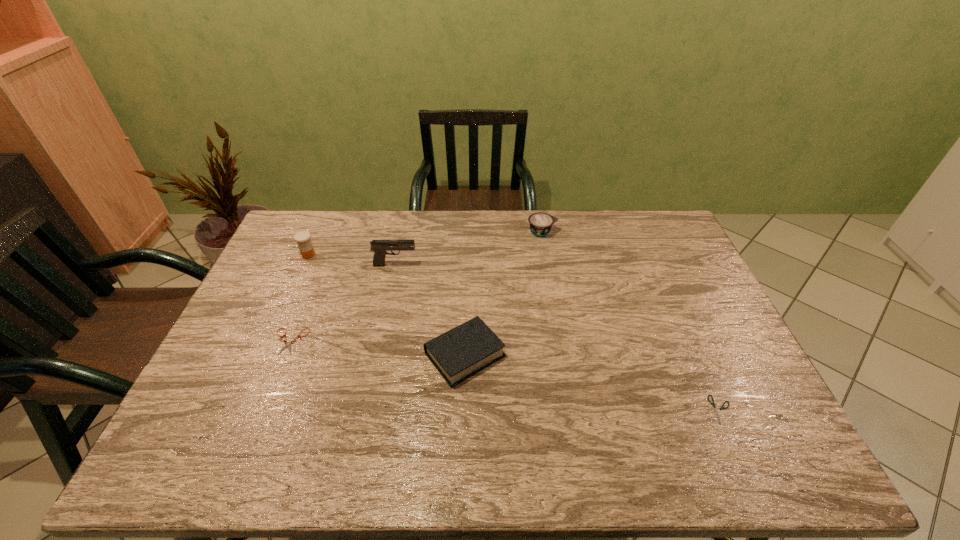
Locate an element on the screen. This screenshot has width=960, height=540. shears present at the left edge is located at coordinates (287, 344).

Locate an element on the screen. Image resolution: width=960 pixels, height=540 pixels. object that is at the right edge is located at coordinates (716, 413).

The height and width of the screenshot is (540, 960). In order to click on object positioned at the far left corner in this screenshot , I will do 302,238.

This screenshot has height=540, width=960. I want to click on free space at the far edge, so click(387, 212).

You are a GUI agent. You are given a task and a screenshot of the screen. Output one action in this format:
    pyautogui.click(x=<x>, y=<y>)
    Task: Click on the free space at the near edge of the desktop
    Image resolution: width=960 pixels, height=540 pixels.
    Given the screenshot: What is the action you would take?
    pyautogui.click(x=344, y=463)

Where is `blank area at the left edge`? blank area at the left edge is located at coordinates (244, 328).

At what (x,y) coordinates should I click in order to perform the action: click on vacant area at the right edge. Please return your answer as a coordinate pair (x, y). Looking at the image, I should click on (673, 268).

The height and width of the screenshot is (540, 960). Identify the location of vacant space at the far right corner of the desktop. 635,223.

Image resolution: width=960 pixels, height=540 pixels. I want to click on free area in between the fifth shortest object and the third object from left to right, so click(x=352, y=260).

This screenshot has height=540, width=960. I want to click on free point between the second tallest object and the farthest object, so click(425, 244).